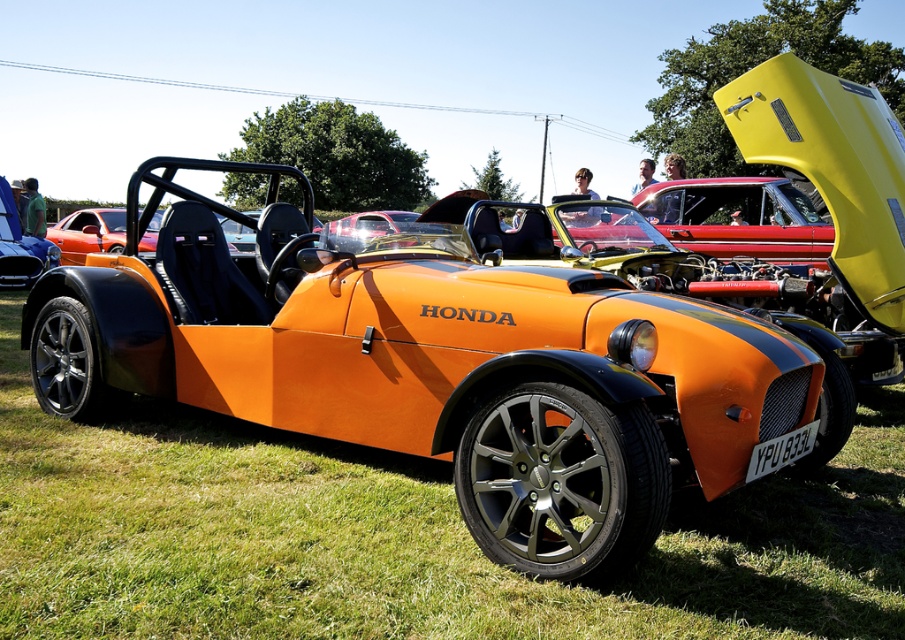
Question: Is orange matte sports car at center behind matte black car at center?

Choices:
 (A) no
 (B) yes

Answer: (A)

Question: Which point is closer to the camera?

Choices:
 (A) orange matte sports car at center
 (B) shiny red car at center
 (C) green grass at lower center
 (D) metallic silver car at center

Answer: (C)

Question: Which is farther from the matte black car at center?

Choices:
 (A) orange matte sports car at center
 (B) shiny red car at center
 (C) green grass at lower center

Answer: (C)

Question: Does green grass at lower center appear on the left side of metallic silver car at center?

Choices:
 (A) no
 (B) yes

Answer: (A)

Question: Can you confirm if shiny red car at center is thinner than metallic silver car at center?

Choices:
 (A) no
 (B) yes

Answer: (A)

Question: Which object is closer to the camera taking this photo?

Choices:
 (A) orange matte sports car at center
 (B) shiny red car at center
 (C) green grass at lower center

Answer: (C)